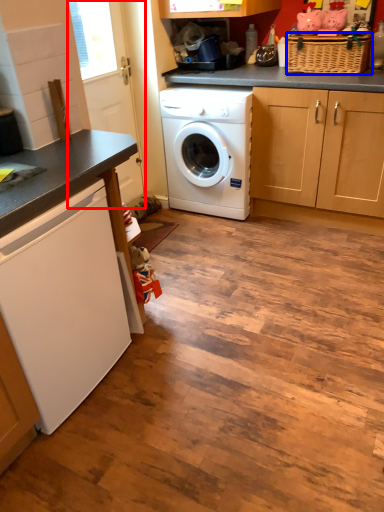
Question: Which object is further to the camera taking this photo, screen door (highlighted by a red box) or basket (highlighted by a blue box)?

Choices:
 (A) screen door
 (B) basket

Answer: (B)